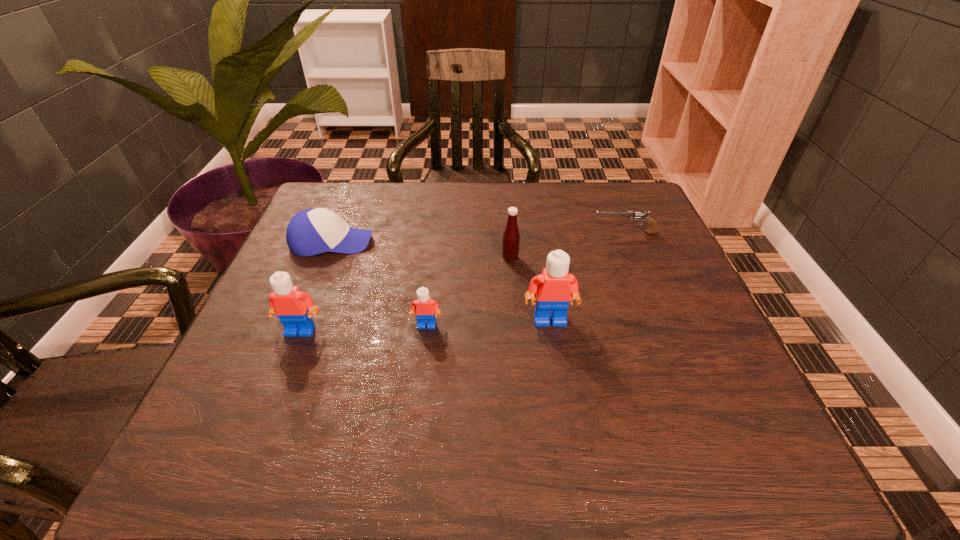
The width and height of the screenshot is (960, 540). Identify the location of vacant area that lies between the baseball cap and the fourth object from right to left. (379, 284).

Identify the location of unoccupied area between the fifth tallest object and the rightmost Lego. This screenshot has height=540, width=960. (441, 281).

Identify the location of empty location between the shortest Lego and the Tabasco sauce. (468, 292).

The width and height of the screenshot is (960, 540). I want to click on free space between the shortest object and the Tabasco sauce, so click(x=567, y=246).

You are a GUI agent. You are given a task and a screenshot of the screen. Output one action in this format:
    pyautogui.click(x=<x>, y=<y>)
    Task: Click on the unoccupied position between the Tabasco sauce and the fifth tallest object
    The image size is (960, 540).
    Given the screenshot: What is the action you would take?
    pyautogui.click(x=420, y=250)

Where is `free space between the fourth object from right to left and the rightmost Lego`? The image size is (960, 540). free space between the fourth object from right to left and the rightmost Lego is located at coordinates (488, 322).

Locate an element on the screen. free space between the third object from left to right and the leftmost Lego is located at coordinates (364, 328).

In order to click on vacant space that's between the second tallest Lego and the fifth tallest object in this screenshot , I will do `click(316, 287)`.

At what (x,y) coordinates should I click in order to perform the action: click on object that is the second closest one to the rightmost Lego. Please return your answer as a coordinate pair (x, y). Looking at the image, I should click on (424, 307).

Point out which object is positioned as the nearest to the second tallest Lego. Please provide its 2D coordinates. Your answer should be formatted as a tuple, i.e. [(x, y)], where the tuple contains the x and y coordinates of a point satisfying the conditions above.

[(424, 307)]